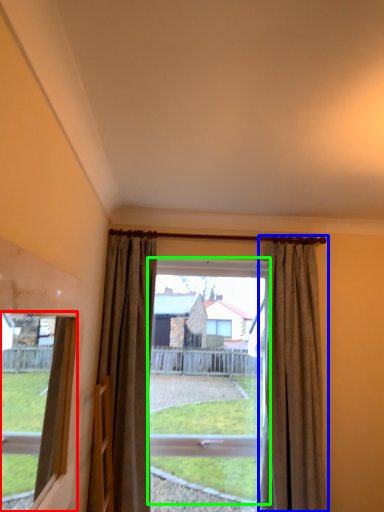
Question: Which object is positioned closest to window (highlighted by a red box)? Select from curtain (highlighted by a blue box) and bay window (highlighted by a green box).

Choices:
 (A) curtain
 (B) bay window

Answer: (B)